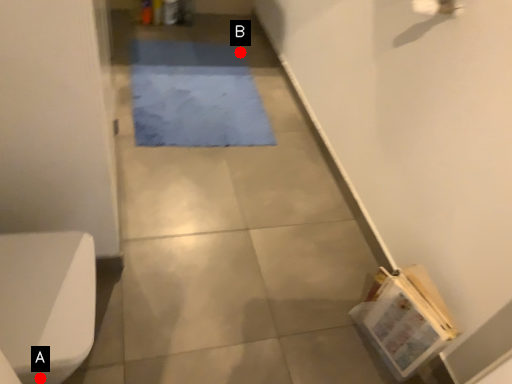
Question: Two points are circled on the image, labeled by A and B beside each circle. Which point is further to the camera?

Choices:
 (A) A is further
 (B) B is further

Answer: (B)